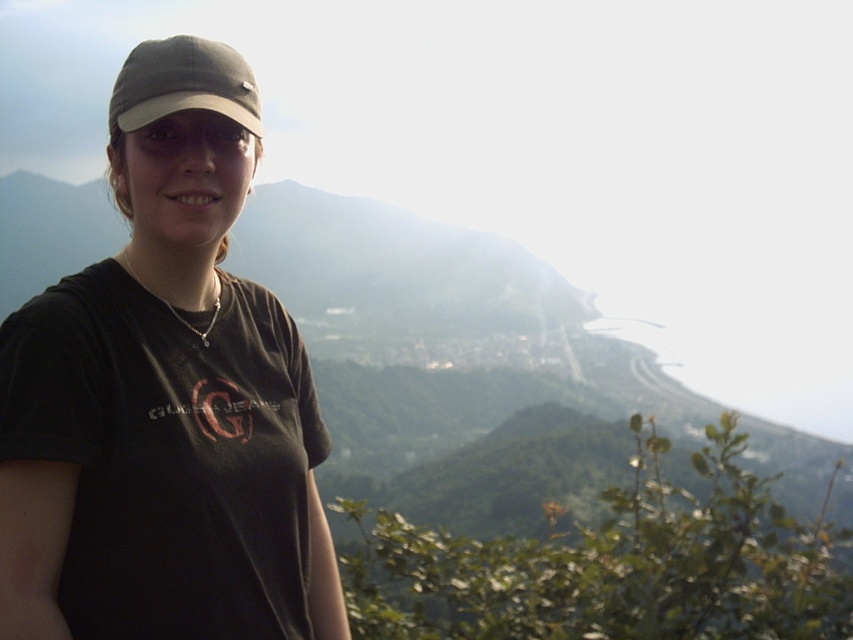
Is black matte cap at upper left further to the viewer compared to matte gray cap at center?

No.

Consider the image. Can you confirm if black matte cap at upper left is shorter than matte gray cap at center?

Yes, black matte cap at upper left is shorter than matte gray cap at center.

Where is `black matte cap at upper left`? The height and width of the screenshot is (640, 853). black matte cap at upper left is located at coordinates (165, 397).